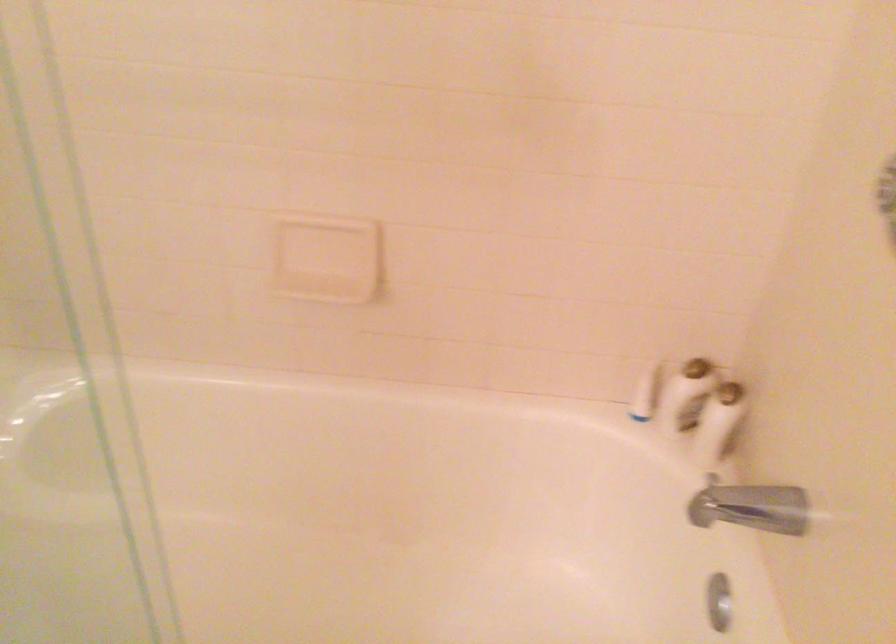
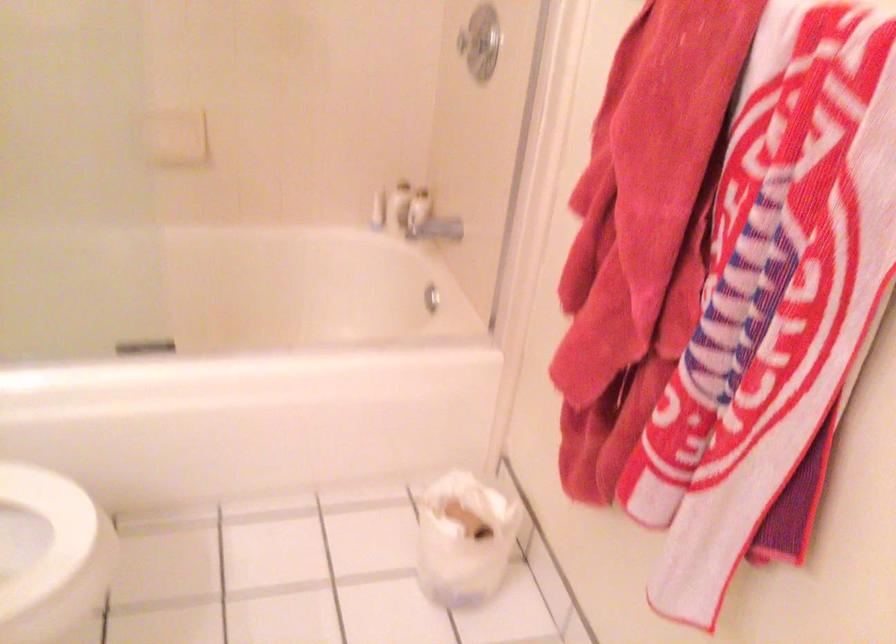
In the second image, find the point that corresponds to point (677, 401) in the first image.

(399, 205)